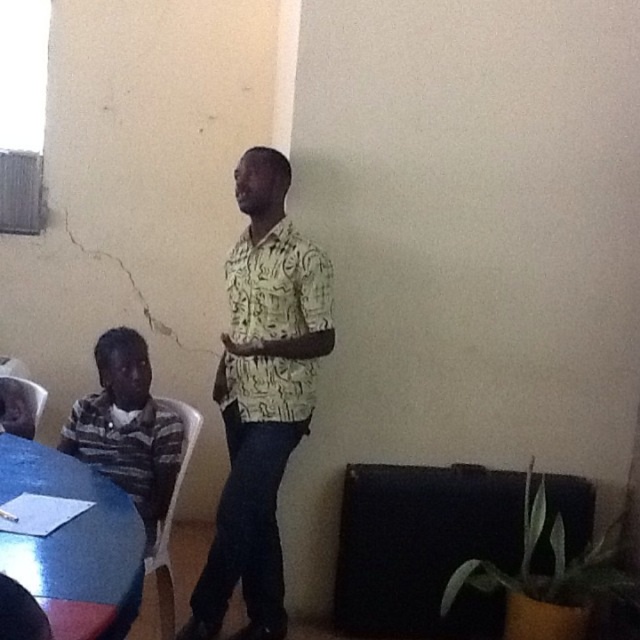
Question: Is yellow printed shirt at center closer to camera compared to smooth glossy wood table at lower left?

Choices:
 (A) yes
 (B) no

Answer: (B)

Question: Which point is closer to the camera taking this photo?

Choices:
 (A) (273, 284)
 (B) (48, 545)

Answer: (B)

Question: From the image, what is the correct spatial relationship of yellow printed shirt at center in relation to smooth glossy wood table at lower left?

Choices:
 (A) below
 (B) above

Answer: (B)

Question: Which of the following is the farthest from the observer?

Choices:
 (A) (232, 493)
 (B) (104, 579)

Answer: (A)

Question: Which point is closer to the camera taking this photo?

Choices:
 (A) (228, 360)
 (B) (96, 598)

Answer: (B)

Question: Observing the image, what is the correct spatial positioning of yellow printed shirt at center in reference to smooth glossy wood table at lower left?

Choices:
 (A) left
 (B) right

Answer: (B)